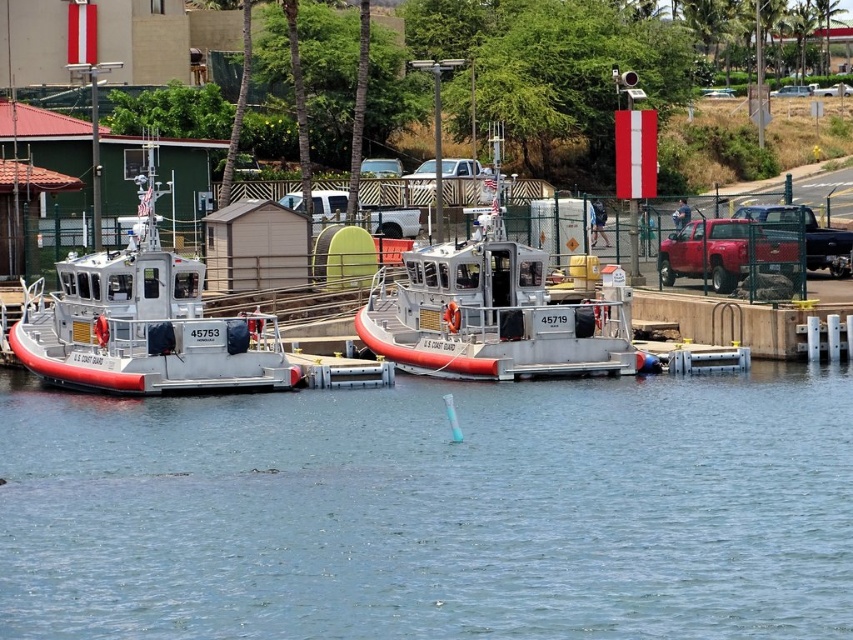
Who is more distant from viewer, (64, 320) or (395, 298)?

Point (395, 298)

Can you confirm if white rubber boat at left is positioned below white matte boat at center?

Yes.

From the picture: Measure the distance between point (149,147) and camera.

Point (149,147) is 73.92 meters from camera.

At what (x,y) coordinates should I click in order to perform the action: click on white rubber boat at left. Please return your answer as a coordinate pair (x, y). The width and height of the screenshot is (853, 640). Looking at the image, I should click on (144, 321).

Can you confirm if transparent water at center is wider than white rubber boat at left?

Yes, transparent water at center is wider than white rubber boat at left.

Does point (466, 547) come farther from viewer compared to point (137, 189)?

No, (466, 547) is in front of (137, 189).

Does point (662, 588) come closer to viewer compared to point (108, 362)?

Yes, it is in front of point (108, 362).

You are a GUI agent. You are given a task and a screenshot of the screen. Output one action in this format:
    pyautogui.click(x=<x>, y=<y>)
    Task: Click on the transparent water at center
    
    Given the screenshot: What is the action you would take?
    pyautogui.click(x=433, y=509)

Does transparent water at center appear over white matte boat at center?

No.

Which is below, transparent water at center or white matte boat at center?

transparent water at center is lower down.

Does point (828, 506) come behind point (422, 262)?

No, it is in front of (422, 262).

This screenshot has height=640, width=853. In order to click on transparent water at center in this screenshot , I will do `click(433, 509)`.